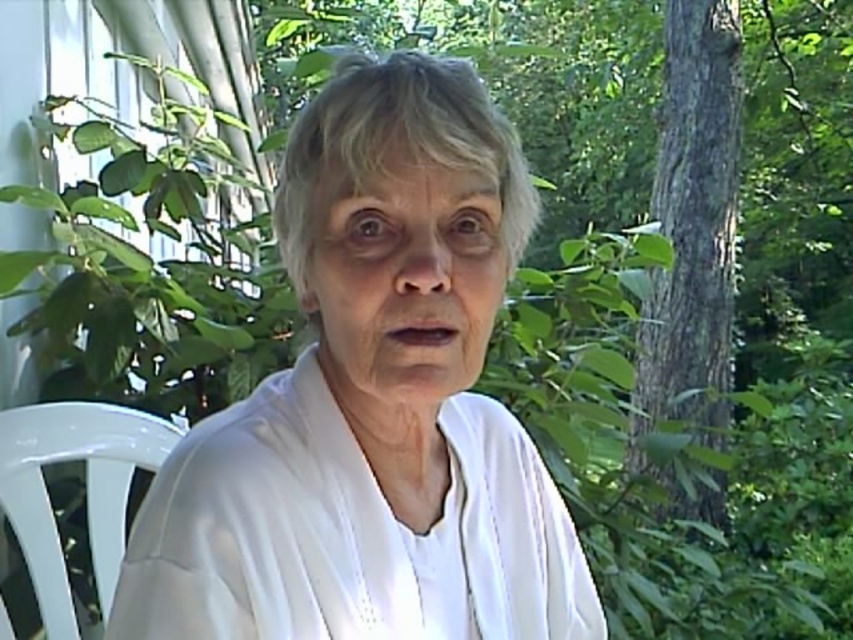
Question: Which point is farther to the camera?

Choices:
 (A) (235, 493)
 (B) (245, 461)
 (C) (64, 637)

Answer: (C)

Question: Does white matte shirt at center appear over white sheer robe at center?

Choices:
 (A) no
 (B) yes

Answer: (B)

Question: Is white matte shirt at center above white sheer robe at center?

Choices:
 (A) no
 (B) yes

Answer: (B)

Question: Which object appears farthest from the camera in this image?

Choices:
 (A) white sheer robe at center
 (B) white matte shirt at center
 (C) white plastic chair at left

Answer: (C)

Question: Is white matte shirt at center below white plastic chair at left?

Choices:
 (A) yes
 (B) no

Answer: (B)

Question: Among these points, which one is nearest to the camera?

Choices:
 (A) (515, 241)
 (B) (344, 620)
 (C) (97, 426)

Answer: (B)